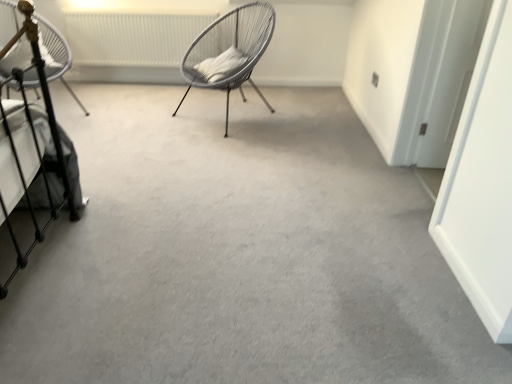
This screenshot has width=512, height=384. Describe the element at coordinates (133, 35) in the screenshot. I see `white textured radiator at upper center` at that location.

Find the location of `white textured radiator at upper center`. white textured radiator at upper center is located at coordinates coord(133,35).

I want to click on white woven chair at left, which is counted as the second chair, starting from the right, so click(x=55, y=54).

Where is `white woven chair at center, acting as the 2th chair starting from the left`? The height and width of the screenshot is (384, 512). white woven chair at center, acting as the 2th chair starting from the left is located at coordinates (229, 51).

Does white textured radiator at upper center turn towards white woven chair at left, which is counted as the second chair, starting from the right?

Yes, white textured radiator at upper center is turned towards white woven chair at left, which is counted as the second chair, starting from the right.

Does point (124, 15) come farther from viewer compared to point (40, 19)?

Yes, it is.

The width and height of the screenshot is (512, 384). I want to click on radiator behind the white woven chair at left, which is counted as the second chair, starting from the right, so click(x=133, y=35).

From the image's perspective, is white textured radiator at upper center below white woven chair at left, the 1th chair in the left-to-right sequence?

Actually, white textured radiator at upper center appears above white woven chair at left, the 1th chair in the left-to-right sequence, in the image.

Is point (200, 35) more distant than point (44, 43)?

Yes, point (200, 35) is farther from viewer.

This screenshot has width=512, height=384. Find the location of `chair that is in front of the white woven chair at center, acting as the 2th chair starting from the left`. chair that is in front of the white woven chair at center, acting as the 2th chair starting from the left is located at coordinates (55, 54).

Between white woven chair at center, placed as the first chair when sorted from right to left, and white woven chair at left, the 1th chair in the left-to-right sequence, which one is positioned behind?

white woven chair at center, placed as the first chair when sorted from right to left, is behind.

Is white woven chair at center, acting as the 2th chair starting from the left, oriented towards white woven chair at left, which is counted as the second chair, starting from the right?

No, white woven chair at center, acting as the 2th chair starting from the left, is not facing towards white woven chair at left, which is counted as the second chair, starting from the right.

Between white woven chair at center, placed as the first chair when sorted from right to left, and white textured radiator at upper center, which one has smaller size?

Smaller between the two is white textured radiator at upper center.

From the image's perspective, which object appears higher, white woven chair at center, acting as the 2th chair starting from the left, or white textured radiator at upper center?

From the image's view, white textured radiator at upper center is above.

Does white woven chair at center, acting as the 2th chair starting from the left, turn towards white textured radiator at upper center?

No, white woven chair at center, acting as the 2th chair starting from the left, does not turn towards white textured radiator at upper center.

Which object is closer to the camera, white woven chair at left, which is counted as the second chair, starting from the right, or white woven chair at center, acting as the 2th chair starting from the left?

white woven chair at left, which is counted as the second chair, starting from the right.

From the picture: From the image's perspective, which is above, white woven chair at left, which is counted as the second chair, starting from the right, or white woven chair at center, placed as the first chair when sorted from right to left?

white woven chair at center, placed as the first chair when sorted from right to left, from the image's perspective.

From a real-world perspective, does white woven chair at left, which is counted as the second chair, starting from the right, stand above white woven chair at center, placed as the first chair when sorted from right to left?

Yes, from a real-world perspective, white woven chair at left, which is counted as the second chair, starting from the right, is above white woven chair at center, placed as the first chair when sorted from right to left.

Considering the sizes of objects white woven chair at left, which is counted as the second chair, starting from the right, and white woven chair at center, placed as the first chair when sorted from right to left, in the image provided, who is wider, white woven chair at left, which is counted as the second chair, starting from the right, or white woven chair at center, placed as the first chair when sorted from right to left,?

Wider between the two is white woven chair at center, placed as the first chair when sorted from right to left.

Looking at the image, does white woven chair at left, the 1th chair in the left-to-right sequence, seem bigger or smaller compared to white textured radiator at upper center?

Considering their sizes, white woven chair at left, the 1th chair in the left-to-right sequence, takes up more space than white textured radiator at upper center.

Is white woven chair at left, the 1th chair in the left-to-right sequence, positioned in front of white textured radiator at upper center?

Yes.

Is white textured radiator at upper center a part of white woven chair at left, the 1th chair in the left-to-right sequence?

Definitely not — white textured radiator at upper center is not inside white woven chair at left, the 1th chair in the left-to-right sequence.

Consider the image. Is there a large distance between white woven chair at left, the 1th chair in the left-to-right sequence, and white textured radiator at upper center?

No, white woven chair at left, the 1th chair in the left-to-right sequence, is not far away from white textured radiator at upper center.

Between white textured radiator at upper center and white woven chair at center, placed as the first chair when sorted from right to left, which one has less height?

Standing shorter between the two is white textured radiator at upper center.

Between white textured radiator at upper center and white woven chair at center, acting as the 2th chair starting from the left, which one appears on the left side from the viewer's perspective?

white textured radiator at upper center.

From a real-world perspective, relative to white woven chair at center, acting as the 2th chair starting from the left, is white textured radiator at upper center vertically above or below?

Clearly, from a real-world perspective, white textured radiator at upper center is below white woven chair at center, acting as the 2th chair starting from the left.

I want to click on chair that is the 2nd object located below the white textured radiator at upper center (from the image's perspective), so click(x=55, y=54).

Where is `chair behind the white woven chair at left, which is counted as the second chair, starting from the right`? Image resolution: width=512 pixels, height=384 pixels. chair behind the white woven chair at left, which is counted as the second chair, starting from the right is located at coordinates (229, 51).

Estimate the real-world distances between objects in this image. Which object is closer to white woven chair at center, placed as the first chair when sorted from right to left, white textured radiator at upper center or white woven chair at left, which is counted as the second chair, starting from the right?

white textured radiator at upper center.

Which object lies nearer to the anchor point white textured radiator at upper center, white woven chair at center, placed as the first chair when sorted from right to left, or white woven chair at left, which is counted as the second chair, starting from the right?

Based on the image, white woven chair at center, placed as the first chair when sorted from right to left, appears to be nearer to white textured radiator at upper center.

Based on their spatial positions, is white woven chair at center, acting as the 2th chair starting from the left, or white textured radiator at upper center further from white woven chair at left, which is counted as the second chair, starting from the right?

Among the two, white woven chair at center, acting as the 2th chair starting from the left, is located further to white woven chair at left, which is counted as the second chair, starting from the right.

Based on their spatial positions, is white woven chair at left, the 1th chair in the left-to-right sequence, or white textured radiator at upper center further from white woven chair at center, placed as the first chair when sorted from right to left?

white woven chair at left, the 1th chair in the left-to-right sequence, is positioned further to the anchor white woven chair at center, placed as the first chair when sorted from right to left.

When comparing their distances from white textured radiator at upper center, does white woven chair at left, the 1th chair in the left-to-right sequence, or white woven chair at center, placed as the first chair when sorted from right to left, seem further?

white woven chair at left, the 1th chair in the left-to-right sequence, is further to white textured radiator at upper center.

From the image, which object appears to be farther from white woven chair at left, which is counted as the second chair, starting from the right, white textured radiator at upper center or white woven chair at center, acting as the 2th chair starting from the left?

The object further to white woven chair at left, which is counted as the second chair, starting from the right, is white woven chair at center, acting as the 2th chair starting from the left.

The height and width of the screenshot is (384, 512). What are the coordinates of `radiator between white woven chair at left, which is counted as the second chair, starting from the right, and white woven chair at center, acting as the 2th chair starting from the left` in the screenshot? It's located at (133, 35).